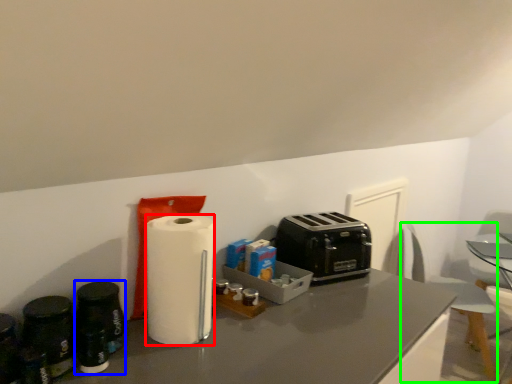
Question: Which object is the closest to the paper towel (highlighted by a red box)? Choose among these: appliance (highlighted by a blue box) or swivel chair (highlighted by a green box).

Choices:
 (A) appliance
 (B) swivel chair

Answer: (A)